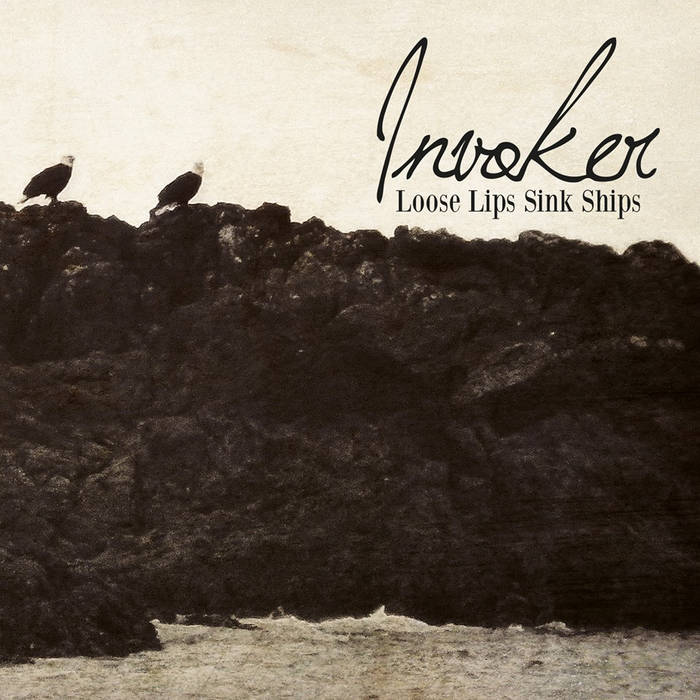
Find the location of `island`. island is located at coordinates (297, 463).